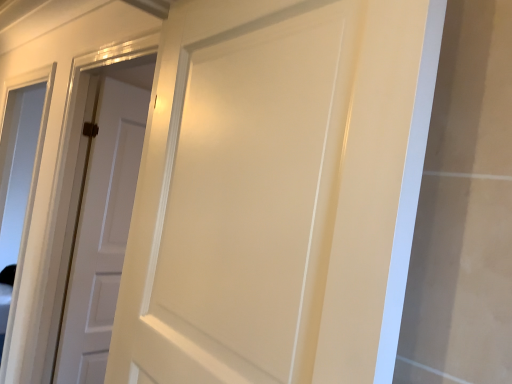
At what (x,y) coordinates should I click in order to perform the action: click on matte white door at center, marked as the first door in a right-to-left arrangement. Please return your answer as a coordinate pair (x, y). This screenshot has width=512, height=384. Looking at the image, I should click on (237, 194).

Identify the location of matte white door at center, positioned as the 2th door in back-to-front order. (237, 194).

Is transparent glass window at left not near white matte door at center, which is the 1th door from back to front?

transparent glass window at left is far away from white matte door at center, which is the 1th door from back to front.

Between transparent glass window at left and white matte door at center, the second door when ordered from front to back, which one has larger width?

With larger width is transparent glass window at left.

Is transparent glass window at left taller or shorter than white matte door at center, the second door when ordered from front to back?

In the image, transparent glass window at left appears to be taller than white matte door at center, the second door when ordered from front to back.

From the image's perspective, which one is positioned higher, transparent glass window at left or white matte door at center, the second door when ordered from front to back?

From the image's view, white matte door at center, the second door when ordered from front to back, is above.

You are a GUI agent. You are given a task and a screenshot of the screen. Output one action in this format:
    pyautogui.click(x=<x>, y=<y>)
    Task: Click on the window behind the white matte door at center, marked as the 1th door in a left-to-right arrangement
    
    Given the screenshot: What is the action you would take?
    pyautogui.click(x=19, y=182)

Based on the photo, from the image's perspective, is white matte door at center, which is the 1th door from back to front, located beneath transparent glass window at left?

Actually, white matte door at center, which is the 1th door from back to front, appears above transparent glass window at left in the image.

Relative to transparent glass window at left, is white matte door at center, marked as the 1th door in a left-to-right arrangement, in front or behind?

Visually, white matte door at center, marked as the 1th door in a left-to-right arrangement, is located in front of transparent glass window at left.

Which is more to the right, white matte door at center, marked as the 1th door in a left-to-right arrangement, or transparent glass window at left?

Positioned to the right is white matte door at center, marked as the 1th door in a left-to-right arrangement.

From the picture: Is transparent glass window at left located within matte white door at center, acting as the first door starting from the front?

No.

From the picture: Is matte white door at center, acting as the first door starting from the front, wider or thinner than transparent glass window at left?

Considering their sizes, matte white door at center, acting as the first door starting from the front, looks broader than transparent glass window at left.

From a real-world perspective, starting from the transparent glass window at left, which door is the 2nd one vertically above it? Please provide its 2D coordinates.

[(237, 194)]

Can you confirm if transparent glass window at left is positioned to the left of matte white door at center, positioned as the 2th door in back-to-front order?

Yes, transparent glass window at left is to the left of matte white door at center, positioned as the 2th door in back-to-front order.

How many degrees apart are the facing directions of transparent glass window at left and matte white door at center, acting as the first door starting from the front?

The facing directions of transparent glass window at left and matte white door at center, acting as the first door starting from the front, are 6.4 degrees apart.

In terms of size, does transparent glass window at left appear bigger or smaller than matte white door at center, acting as the first door starting from the front?

In the image, transparent glass window at left appears to be larger than matte white door at center, acting as the first door starting from the front.

From the image's perspective, starting from the transparent glass window at left, which door is the 2nd one above? Please provide its 2D coordinates.

[(237, 194)]

Is matte white door at center, marked as the first door in a right-to-left arrangement, aimed at white matte door at center, the second door when ordered from front to back?

No, matte white door at center, marked as the first door in a right-to-left arrangement, is not turned towards white matte door at center, the second door when ordered from front to back.

Which point is more distant from viewer, (x=287, y=344) or (x=116, y=155)?

Point (x=116, y=155)

Is matte white door at center, acting as the second door starting from the left, with white matte door at center, which ranks as the second door in right-to-left order?

No, matte white door at center, acting as the second door starting from the left, is not beside white matte door at center, which ranks as the second door in right-to-left order.

Considering the relative sizes of matte white door at center, acting as the first door starting from the front, and white matte door at center, marked as the 1th door in a left-to-right arrangement, in the image provided, is matte white door at center, acting as the first door starting from the front, thinner than white matte door at center, marked as the 1th door in a left-to-right arrangement,?

No, matte white door at center, acting as the first door starting from the front, is not thinner than white matte door at center, marked as the 1th door in a left-to-right arrangement.

Would you consider white matte door at center, the second door when ordered from front to back, to be distant from matte white door at center, positioned as the 2th door in back-to-front order?

Indeed, white matte door at center, the second door when ordered from front to back, is not near matte white door at center, positioned as the 2th door in back-to-front order.

Would you say white matte door at center, which ranks as the second door in right-to-left order, is outside matte white door at center, acting as the second door starting from the left?

Yes.

Image resolution: width=512 pixels, height=384 pixels. In order to click on door to the left of matte white door at center, acting as the second door starting from the left in this screenshot , I will do click(103, 224).

Considering the relative sizes of white matte door at center, the second door when ordered from front to back, and matte white door at center, positioned as the 2th door in back-to-front order, in the image provided, is white matte door at center, the second door when ordered from front to back, thinner than matte white door at center, positioned as the 2th door in back-to-front order,?

Yes.

Image resolution: width=512 pixels, height=384 pixels. In order to click on window on the left of white matte door at center, marked as the 1th door in a left-to-right arrangement in this screenshot , I will do `click(19, 182)`.

Find the location of a particular element. The image size is (512, 384). the 1st door located above the transparent glass window at left (from a real-world perspective) is located at coordinates (103, 224).

Based on their spatial positions, is white matte door at center, which is the 1th door from back to front, or transparent glass window at left closer to matte white door at center, acting as the second door starting from the left?

Based on the image, white matte door at center, which is the 1th door from back to front, appears to be nearer to matte white door at center, acting as the second door starting from the left.

Estimate the real-world distances between objects in this image. Which object is further from white matte door at center, the second door when ordered from front to back, matte white door at center, marked as the first door in a right-to-left arrangement, or transparent glass window at left?

transparent glass window at left is further to white matte door at center, the second door when ordered from front to back.

Looking at the image, which one is located further to matte white door at center, acting as the second door starting from the left, transparent glass window at left or white matte door at center, which ranks as the second door in right-to-left order?

transparent glass window at left is further to matte white door at center, acting as the second door starting from the left.

Consider the image. Which object lies nearer to the anchor point white matte door at center, the second door when ordered from front to back, transparent glass window at left or matte white door at center, acting as the first door starting from the front?

Based on the image, matte white door at center, acting as the first door starting from the front, appears to be nearer to white matte door at center, the second door when ordered from front to back.

From the image, which object appears to be nearer to transparent glass window at left, matte white door at center, positioned as the 2th door in back-to-front order, or white matte door at center, marked as the 1th door in a left-to-right arrangement?

white matte door at center, marked as the 1th door in a left-to-right arrangement.

From the image, which object appears to be nearer to transparent glass window at left, white matte door at center, the second door when ordered from front to back, or matte white door at center, acting as the second door starting from the left?

white matte door at center, the second door when ordered from front to back, is positioned closer to the anchor transparent glass window at left.

Find the location of a particular element. Image resolution: width=512 pixels, height=384 pixels. door positioned between matte white door at center, acting as the second door starting from the left, and transparent glass window at left from near to far is located at coordinates (103, 224).